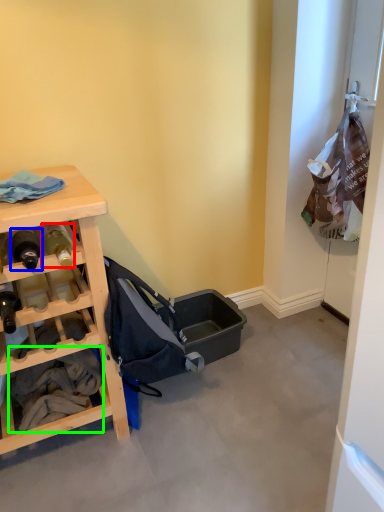
Question: Considering the real-world distances, which object is closest to bottle (highlighted by a red box)? bottle (highlighted by a blue box) or clothing (highlighted by a green box).

Choices:
 (A) bottle
 (B) clothing

Answer: (A)